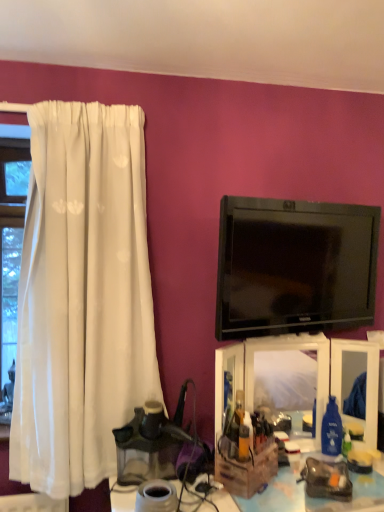
Image resolution: width=384 pixels, height=512 pixels. What do you see at coordinates (276, 383) in the screenshot?
I see `translucent plastic makeup organizer at center` at bounding box center [276, 383].

Where is `black glossy tv at upper right`? This screenshot has width=384, height=512. black glossy tv at upper right is located at coordinates (x=294, y=267).

Between black glossy tv at upper right and wooden crate at lower right, which one is positioned behind?

black glossy tv at upper right is further from the camera.

Is black glossy tv at upper right wider than wooden crate at lower right?

In fact, black glossy tv at upper right might be narrower than wooden crate at lower right.

The image size is (384, 512). I want to click on television above the wooden crate at lower right (from a real-world perspective), so click(x=294, y=267).

Does translucent plastic makeup organizer at center contain wooden crate at lower right?

No, wooden crate at lower right is not surrounded by translucent plastic makeup organizer at center.

Consider the image. Is translucent plastic makeup organizer at center wider than wooden crate at lower right?

No, translucent plastic makeup organizer at center is not wider than wooden crate at lower right.

Which of these two, translucent plastic makeup organizer at center or wooden crate at lower right, stands taller?

translucent plastic makeup organizer at center.

Is the surface of translucent plastic makeup organizer at center in direct contact with wooden crate at lower right?

translucent plastic makeup organizer at center and wooden crate at lower right are clearly separated.

Can you confirm if translucent plastic makeup organizer at center is positioned to the right of black glossy tv at upper right?

No.

From the image's perspective, would you say translucent plastic makeup organizer at center is positioned over black glossy tv at upper right?

No, from the image's perspective, translucent plastic makeup organizer at center is not on top of black glossy tv at upper right.

The height and width of the screenshot is (512, 384). I want to click on entertainment center below the black glossy tv at upper right (from the image's perspective), so click(x=276, y=383).

Which of these two, translucent plastic makeup organizer at center or black glossy tv at upper right, is thinner?

black glossy tv at upper right is thinner.

From a real-world perspective, is black glossy tv at upper right on translucent plastic makeup organizer at center?

Yes, from a real-world perspective, black glossy tv at upper right is on top of translucent plastic makeup organizer at center.

Could you tell me if black glossy tv at upper right is turned towards translucent plastic makeup organizer at center?

No, black glossy tv at upper right does not turn towards translucent plastic makeup organizer at center.

Is black glossy tv at upper right bigger than translucent plastic makeup organizer at center?

No, black glossy tv at upper right is not bigger than translucent plastic makeup organizer at center.

Based on the photo, considering the sizes of wooden crate at lower right and translucent plastic makeup organizer at center in the image, is wooden crate at lower right bigger or smaller than translucent plastic makeup organizer at center?

Considering their sizes, wooden crate at lower right takes up more space than translucent plastic makeup organizer at center.

Is the position of wooden crate at lower right more distant than that of translucent plastic makeup organizer at center?

No, it is not.

Is translucent plastic makeup organizer at center surrounded by wooden crate at lower right?

That's incorrect, translucent plastic makeup organizer at center is not inside wooden crate at lower right.

How many degrees apart are the facing directions of wooden crate at lower right and black glossy tv at upper right?

wooden crate at lower right and black glossy tv at upper right are facing 15.1 degrees away from each other.

Between wooden crate at lower right and black glossy tv at upper right, which one is positioned in front?

wooden crate at lower right is closer to the camera.

From their relative heights in the image, would you say wooden crate at lower right is taller or shorter than black glossy tv at upper right?

Clearly, wooden crate at lower right is shorter compared to black glossy tv at upper right.

At what (x,y) coordinates should I click in order to perform the action: click on table in front of the black glossy tv at upper right. Please return your answer as a coordinate pair (x, y). Looking at the image, I should click on (316, 499).

What are the coordinates of `table below the translucent plastic makeup organizer at center (from the image's perspective)` in the screenshot? It's located at (316, 499).

When comparing their distances from black glossy tv at upper right, does translucent plastic makeup organizer at center or wooden crate at lower right seem further?

wooden crate at lower right is further to black glossy tv at upper right.

Considering their positions, is wooden crate at lower right positioned further to black glossy tv at upper right than translucent plastic makeup organizer at center?

Among the two, wooden crate at lower right is located further to black glossy tv at upper right.

Estimate the real-world distances between objects in this image. Which object is further from wooden crate at lower right, black glossy tv at upper right or translucent plastic makeup organizer at center?

black glossy tv at upper right.

Looking at the image, which one is located closer to translucent plastic makeup organizer at center, wooden crate at lower right or black glossy tv at upper right?

wooden crate at lower right is positioned closer to the anchor translucent plastic makeup organizer at center.

When comparing their distances from wooden crate at lower right, does translucent plastic makeup organizer at center or black glossy tv at upper right seem further?

black glossy tv at upper right lies further to wooden crate at lower right than the other object.

Considering their positions, is black glossy tv at upper right positioned closer to translucent plastic makeup organizer at center than wooden crate at lower right?

wooden crate at lower right is positioned closer to the anchor translucent plastic makeup organizer at center.

The height and width of the screenshot is (512, 384). I want to click on entertainment center between black glossy tv at upper right and wooden crate at lower right from top to bottom, so click(x=276, y=383).